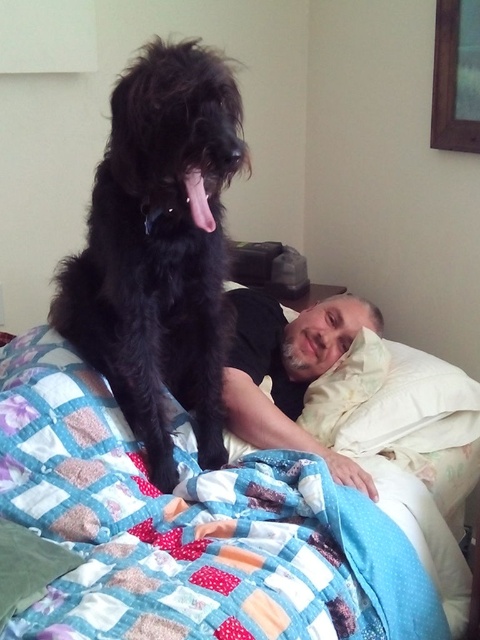
You are a photographer trying to capture a clear shot of the black fluffy dog at upper left. However, the quilted fabric bed at upper left is blocking your view. Can you adjust your position to see the dog better?

The quilted fabric bed at upper left is closer to the viewer than the black fluffy dog at upper left, so moving your position to get around the quilted fabric bed at upper left would allow you to see the black fluffy dog at upper left better.

You are taking a photo of the scene and want to focus on both point (372, 472) and point (456, 438). Which point should you focus on first to ensure both are in sharp focus?

You should focus on point (372, 472) first because it is closer to the camera than point (456, 438). This way, the camera can adjust the focus to capture both points clearly.